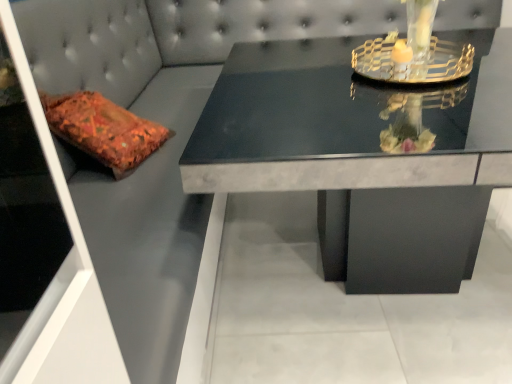
Question: Is black marble table at center thinner than clear glass candle holder at upper right?

Choices:
 (A) yes
 (B) no

Answer: (B)

Question: Could you tell me if black marble table at center is facing clear glass candle holder at upper right?

Choices:
 (A) no
 (B) yes

Answer: (A)

Question: Is black marble table at center wider than clear glass candle holder at upper right?

Choices:
 (A) yes
 (B) no

Answer: (A)

Question: From a real-world perspective, does black marble table at center stand above clear glass candle holder at upper right?

Choices:
 (A) yes
 (B) no

Answer: (B)

Question: Does black marble table at center appear on the right side of clear glass candle holder at upper right?

Choices:
 (A) no
 (B) yes

Answer: (A)

Question: From a real-world perspective, is clear glass candle holder at upper right physically located above or below transparent glass door at left?

Choices:
 (A) above
 (B) below

Answer: (A)

Question: Does point (467, 52) appear closer or farther from the camera than point (24, 92)?

Choices:
 (A) closer
 (B) farther

Answer: (B)

Question: Would you say clear glass candle holder at upper right is to the left or to the right of transparent glass door at left in the picture?

Choices:
 (A) right
 (B) left

Answer: (A)

Question: In terms of width, does clear glass candle holder at upper right look wider or thinner when compared to transparent glass door at left?

Choices:
 (A) thin
 (B) wide

Answer: (A)

Question: From the image's perspective, relative to clear glass candle holder at upper right, is black marble table at center above or below?

Choices:
 (A) below
 (B) above

Answer: (A)

Question: From a real-world perspective, is black marble table at center physically located above or below clear glass candle holder at upper right?

Choices:
 (A) below
 (B) above

Answer: (A)

Question: In the image, is black marble table at center on the left side or the right side of clear glass candle holder at upper right?

Choices:
 (A) left
 (B) right

Answer: (A)

Question: Considering the positions of black marble table at center and clear glass candle holder at upper right in the image, is black marble table at center taller or shorter than clear glass candle holder at upper right?

Choices:
 (A) tall
 (B) short

Answer: (A)

Question: Is black marble table at center to the left or to the right of transparent glass door at left in the image?

Choices:
 (A) right
 (B) left

Answer: (A)

Question: From the image's perspective, is black marble table at center located above or below transparent glass door at left?

Choices:
 (A) above
 (B) below

Answer: (A)